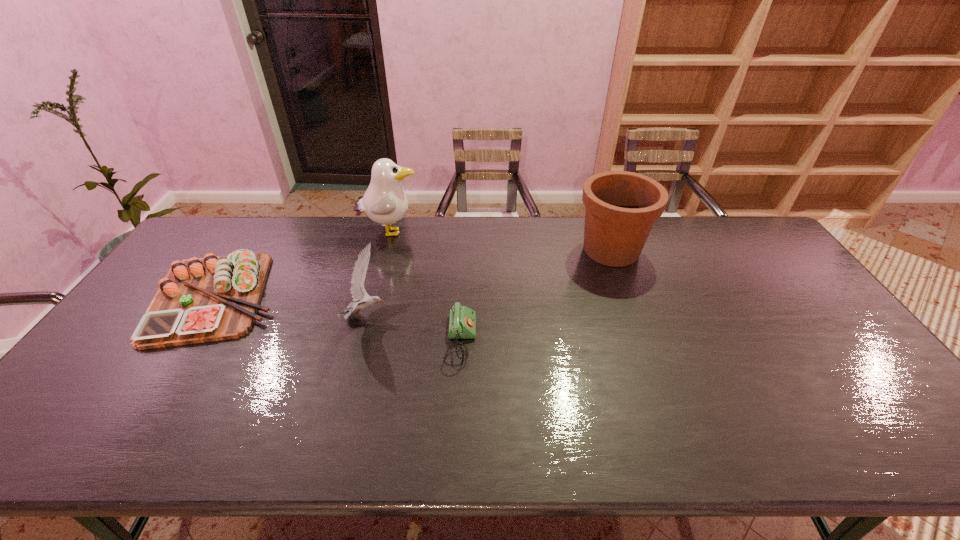
In order to click on empty space between the rightmost object and the telephone in this screenshot , I will do `click(536, 295)`.

This screenshot has height=540, width=960. In order to click on vacant point located between the platter and the shortest object in this screenshot , I will do `click(338, 319)`.

Where is `free spot between the third shortest object and the shortest object`? free spot between the third shortest object and the shortest object is located at coordinates [413, 328].

Locate an element on the screen. Image resolution: width=960 pixels, height=540 pixels. empty location between the taller gull and the fourth object from left to right is located at coordinates (425, 286).

Where is `unoccupied position between the third tallest object and the rightmost object`? The width and height of the screenshot is (960, 540). unoccupied position between the third tallest object and the rightmost object is located at coordinates (489, 283).

Where is `free space between the shorter gull and the fourth object from left to right`? free space between the shorter gull and the fourth object from left to right is located at coordinates (413, 328).

Identify which object is the second nearest to the flowerpot. Please provide its 2D coordinates. Your answer should be formatted as a tuple, i.e. [(x, y)], where the tuple contains the x and y coordinates of a point satisfying the conditions above.

[(385, 202)]

Where is `object that is the fourth closest one to the platter`? The width and height of the screenshot is (960, 540). object that is the fourth closest one to the platter is located at coordinates (621, 207).